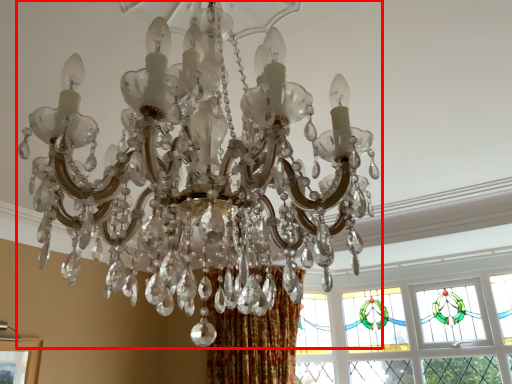
Question: From the image's perspective, what is the correct spatial positioning of lamp (annotated by the red box) in reference to window?

Choices:
 (A) above
 (B) below

Answer: (A)